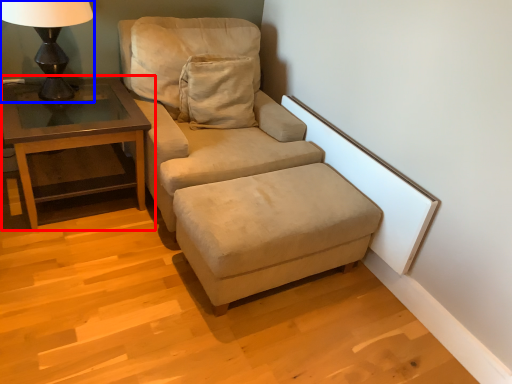
Question: Which object is further to the camera taking this photo, table (highlighted by a red box) or table lamp (highlighted by a blue box)?

Choices:
 (A) table
 (B) table lamp

Answer: (A)